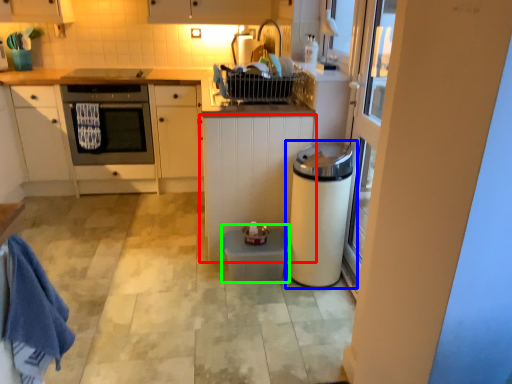
Question: Which is nearer to the cabinetry (highlighted by a red box)? kitchen appliance (highlighted by a blue box) or water heater (highlighted by a green box).

Choices:
 (A) kitchen appliance
 (B) water heater

Answer: (A)